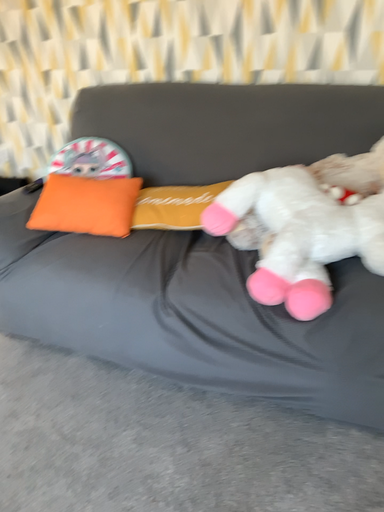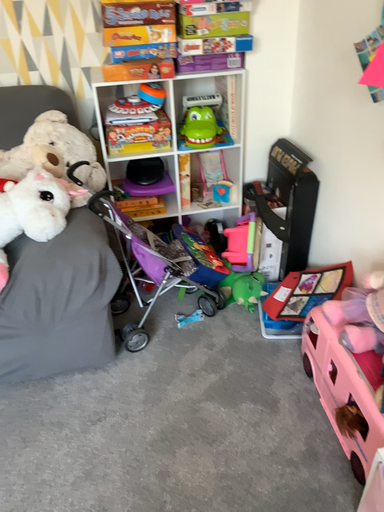
Question: Which way did the camera rotate in the video?

Choices:
 (A) rotated left
 (B) rotated right

Answer: (B)